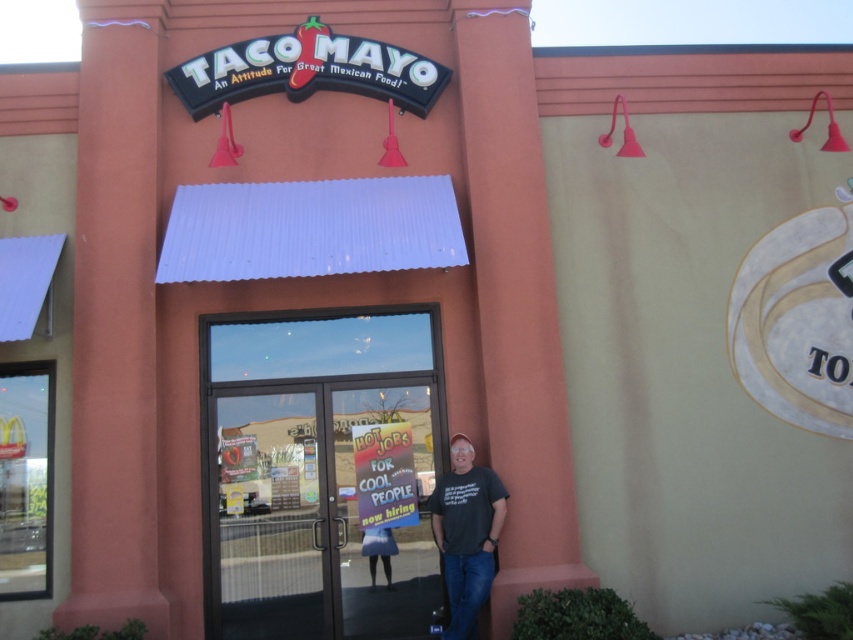
Question: Can you confirm if transparent glass door at center is bigger than dark gray t-shirt at center?

Choices:
 (A) yes
 (B) no

Answer: (A)

Question: Does transparent glass door at center appear on the left side of dark gray t-shirt at center?

Choices:
 (A) yes
 (B) no

Answer: (A)

Question: Can you confirm if transparent glass door at center is positioned to the left of dark gray t-shirt at center?

Choices:
 (A) yes
 (B) no

Answer: (A)

Question: Among these objects, which one is nearest to the camera?

Choices:
 (A) dark gray t-shirt at center
 (B) transparent glass door at center

Answer: (A)